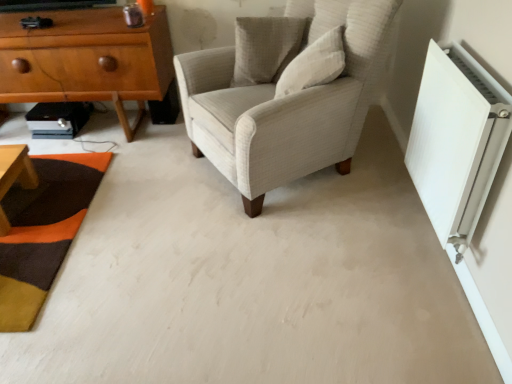
Question: Considering the relative positions of white cotton pillow at upper center, the second pillow positioned from the back, and light beige fabric armchair at center in the image provided, is white cotton pillow at upper center, the second pillow positioned from the back, in front of light beige fabric armchair at center?

Choices:
 (A) no
 (B) yes

Answer: (A)

Question: Does white cotton pillow at upper center, the second pillow positioned from the back, have a larger size compared to light beige fabric armchair at center?

Choices:
 (A) no
 (B) yes

Answer: (A)

Question: Can you confirm if white cotton pillow at upper center, the first pillow when ordered from front to back, is taller than light beige fabric armchair at center?

Choices:
 (A) no
 (B) yes

Answer: (A)

Question: Is white cotton pillow at upper center, the second pillow positioned from the back, shorter than light beige fabric armchair at center?

Choices:
 (A) yes
 (B) no

Answer: (A)

Question: Can you confirm if white cotton pillow at upper center, the second pillow positioned from the back, is wider than light beige fabric armchair at center?

Choices:
 (A) yes
 (B) no

Answer: (B)

Question: From a real-world perspective, is white cotton pillow at upper center, the first pillow when ordered from front to back, physically below light beige fabric armchair at center?

Choices:
 (A) no
 (B) yes

Answer: (A)

Question: Is textured wool mat at lower left thinner than white plastic radiator at right?

Choices:
 (A) yes
 (B) no

Answer: (B)

Question: Is textured wool mat at lower left shorter than white plastic radiator at right?

Choices:
 (A) no
 (B) yes

Answer: (B)

Question: From a real-world perspective, is textured wool mat at lower left located beneath white plastic radiator at right?

Choices:
 (A) no
 (B) yes

Answer: (B)

Question: Does textured wool mat at lower left have a smaller size compared to white plastic radiator at right?

Choices:
 (A) no
 (B) yes

Answer: (B)

Question: Is textured wool mat at lower left in front of white plastic radiator at right?

Choices:
 (A) no
 (B) yes

Answer: (A)

Question: Could you tell me if textured wool mat at lower left is facing white plastic radiator at right?

Choices:
 (A) yes
 (B) no

Answer: (B)

Question: Can you confirm if textured beige pillow at upper center, the 2th pillow positioned from the front, is positioned to the left of light beige fabric armchair at center?

Choices:
 (A) yes
 (B) no

Answer: (A)